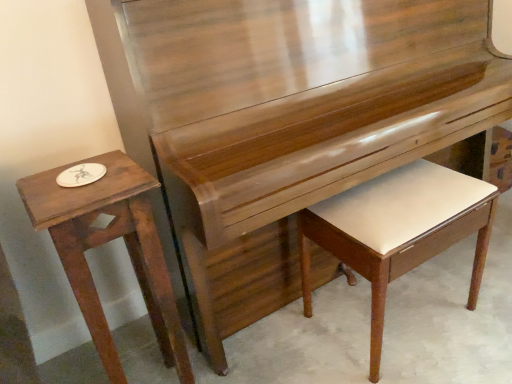
Question: Does wooden table at left contain white leather music stool at lower right?

Choices:
 (A) yes
 (B) no

Answer: (B)

Question: Is wooden table at left at the right side of white leather music stool at lower right?

Choices:
 (A) yes
 (B) no

Answer: (B)

Question: Can you confirm if wooden table at left is wider than white leather music stool at lower right?

Choices:
 (A) no
 (B) yes

Answer: (A)

Question: Is wooden table at left with white leather music stool at lower right?

Choices:
 (A) no
 (B) yes

Answer: (A)

Question: Can you confirm if wooden table at left is thinner than white leather music stool at lower right?

Choices:
 (A) no
 (B) yes

Answer: (B)

Question: Does wooden table at left come in front of white leather music stool at lower right?

Choices:
 (A) no
 (B) yes

Answer: (B)

Question: Can you confirm if white leather music stool at lower right is thinner than wooden table at left?

Choices:
 (A) yes
 (B) no

Answer: (B)

Question: Can you confirm if white leather music stool at lower right is positioned to the right of wooden table at left?

Choices:
 (A) yes
 (B) no

Answer: (A)

Question: From a real-world perspective, is white leather music stool at lower right on top of wooden table at left?

Choices:
 (A) no
 (B) yes

Answer: (A)

Question: Is white leather music stool at lower right taller than wooden table at left?

Choices:
 (A) yes
 (B) no

Answer: (B)

Question: Is white leather music stool at lower right positioned in front of wooden table at left?

Choices:
 (A) yes
 (B) no

Answer: (B)

Question: From the image's perspective, is white leather music stool at lower right beneath wooden table at left?

Choices:
 (A) yes
 (B) no

Answer: (B)

Question: From the image's perspective, relative to wooden table at left, is white leather music stool at lower right above or below?

Choices:
 (A) above
 (B) below

Answer: (A)